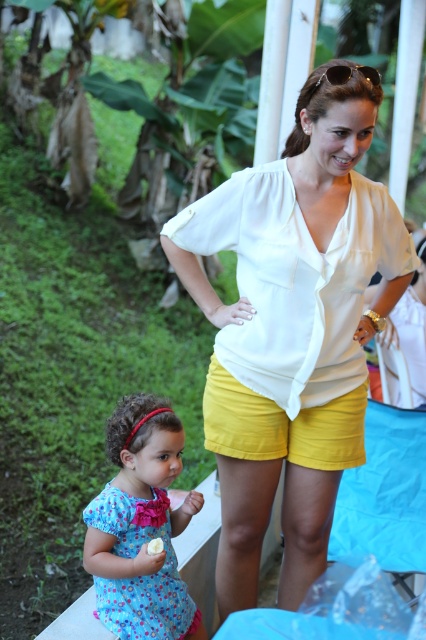
Can you confirm if white silky blouse at center is shorter than yellow cotton shorts at center?

No, white silky blouse at center is not shorter than yellow cotton shorts at center.

Does white silky blouse at center lie behind yellow cotton shorts at center?

That is False.

Which is behind, point (360, 340) or point (304, 442)?

The point (304, 442) is more distant.

The height and width of the screenshot is (640, 426). In order to click on white silky blouse at center in this screenshot , I will do `click(293, 326)`.

Which is in front, point (250, 576) or point (161, 540)?

Point (161, 540) is in front.

Which of these two, white silky blouse at center or white creamy banana at lower center, stands taller?

white silky blouse at center

Identify the location of white silky blouse at center. (293, 326).

Can you confirm if white silky blouse at center is wider than blue floral dress at lower left?

Correct, the width of white silky blouse at center exceeds that of blue floral dress at lower left.

Does white silky blouse at center appear over blue floral dress at lower left?

Correct, white silky blouse at center is located above blue floral dress at lower left.

Who is more distant from viewer, (344, 221) or (150, 497)?

The point (150, 497) is behind.

Locate an element on the screen. Image resolution: width=426 pixels, height=640 pixels. white silky blouse at center is located at coordinates (293, 326).